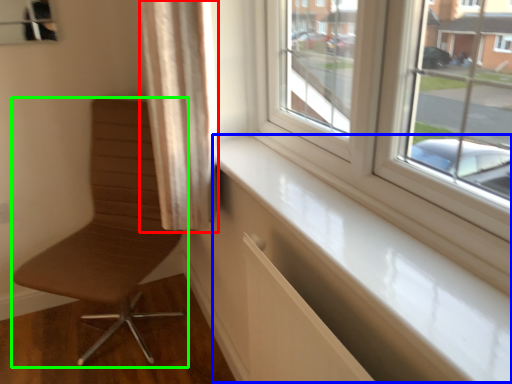
Question: Based on their relative distances, which object is nearer to curtain (highlighted by a red box)? Choose from window sill (highlighted by a blue box) and chair (highlighted by a green box).

Choices:
 (A) window sill
 (B) chair

Answer: (A)